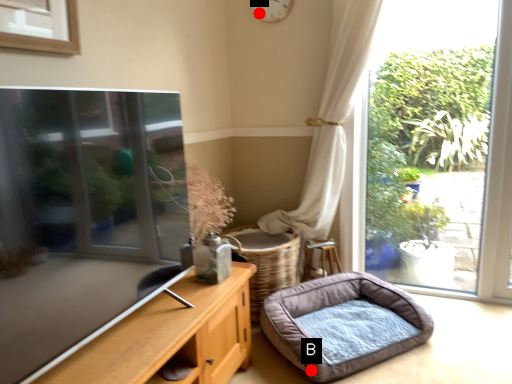
Question: Two points are circled on the image, labeled by A and B beside each circle. Among these points, which one is farthest from the camera?

Choices:
 (A) A is further
 (B) B is further

Answer: (A)